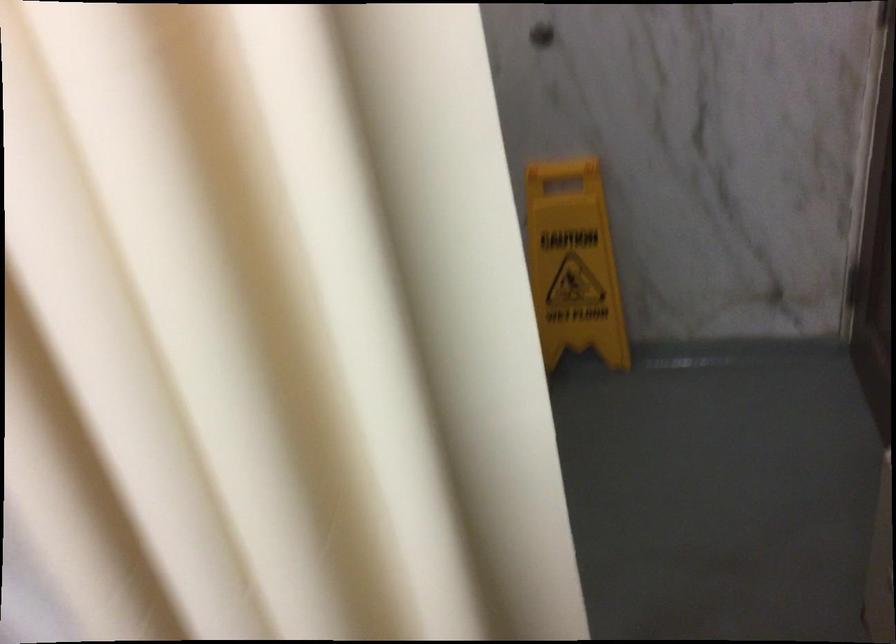
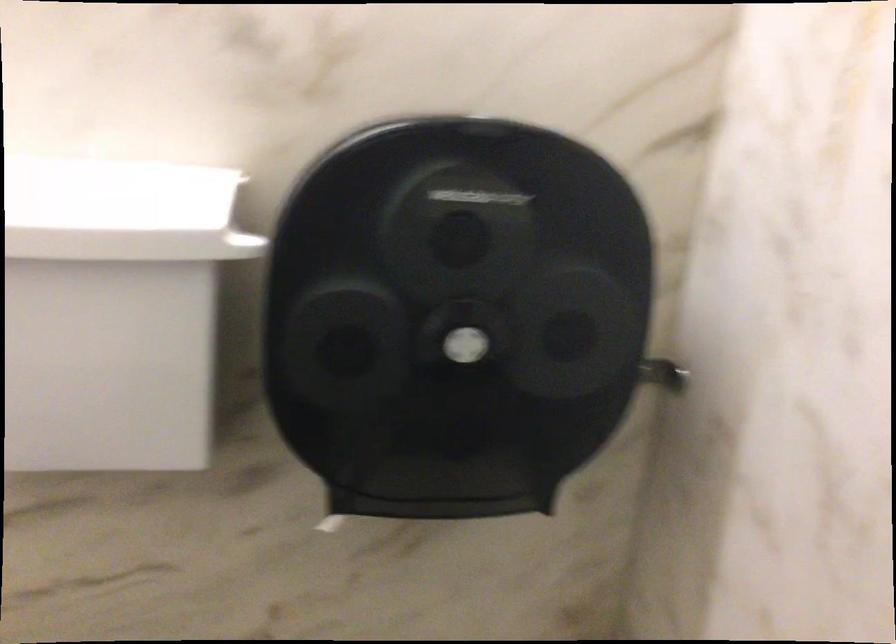
Question: Based on the continuous images, in which direction is the camera rotating? Reply with the corresponding letter.

Choices:
 (A) Left
 (B) Right
 (C) Up
 (D) Down

Answer: (A)